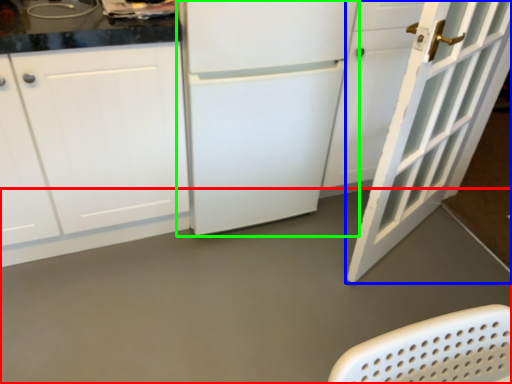
Question: Estimate the real-world distances between objects in this image. Which object is closer to concrete (highlighted by a red box), door (highlighted by a blue box) or refrigerator (highlighted by a green box)?

Choices:
 (A) door
 (B) refrigerator

Answer: (A)